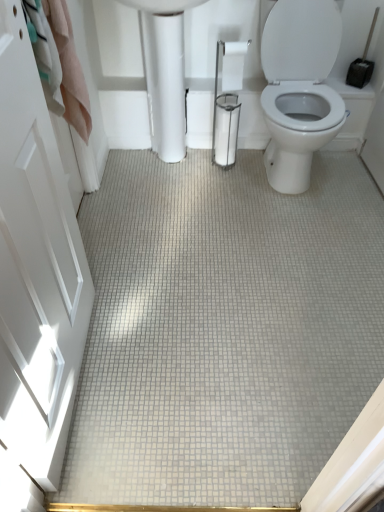
The image size is (384, 512). I want to click on unoccupied space behind white glossy door at left, so click(129, 294).